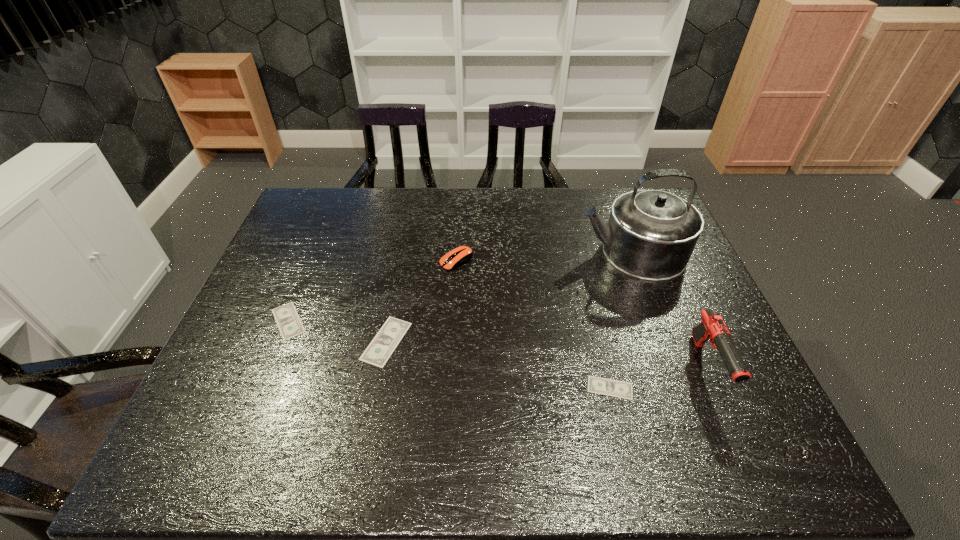
The image size is (960, 540). I want to click on vacant space that's between the second tallest object and the rightmost money, so click(659, 377).

Locate an element on the screen. object that is the closest to the shortest money is located at coordinates (712, 328).

Select which object appears as the fourth closest to the second shortest money. Please provide its 2D coordinates. Your answer should be formatted as a tuple, i.e. [(x, y)], where the tuple contains the x and y coordinates of a point satisfying the conditions above.

[(651, 234)]

Find the location of a particular element. This screenshot has height=540, width=960. money object that ranks as the second closest to the leftmost money is located at coordinates (614, 388).

Select which money is the closest to the third shortest object. Please provide its 2D coordinates. Your answer should be formatted as a tuple, i.e. [(x, y)], where the tuple contains the x and y coordinates of a point satisfying the conditions above.

[(288, 321)]

You are a GUI agent. You are given a task and a screenshot of the screen. Output one action in this format:
    pyautogui.click(x=<x>, y=<y>)
    Task: Click on the blank space that satisfies the following two spatial constraints: 1. on the back side of the third shortest object; 2. on the right side of the fourth shortest object
    
    Given the screenshot: What is the action you would take?
    pyautogui.click(x=401, y=261)

The width and height of the screenshot is (960, 540). I want to click on vacant space that satisfies the following two spatial constraints: 1. with the spout at the front of the kettle; 2. on the front side of the rightmost money, so click(x=683, y=388).